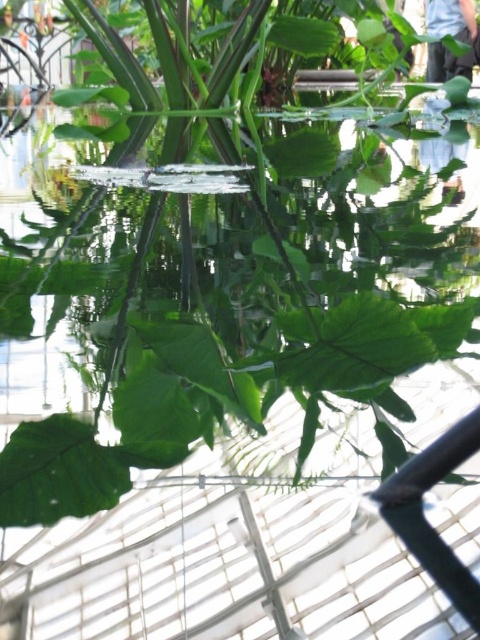
Question: Can you confirm if transparent liquid water at center is wider than blue jeans at upper right?

Choices:
 (A) no
 (B) yes

Answer: (B)

Question: Does transparent liquid water at center appear on the left side of blue jeans at upper right?

Choices:
 (A) yes
 (B) no

Answer: (A)

Question: Can you confirm if transparent liquid water at center is thinner than blue jeans at upper right?

Choices:
 (A) no
 (B) yes

Answer: (A)

Question: Which object appears farthest from the camera in this image?

Choices:
 (A) transparent liquid water at center
 (B) blue jeans at upper right

Answer: (B)